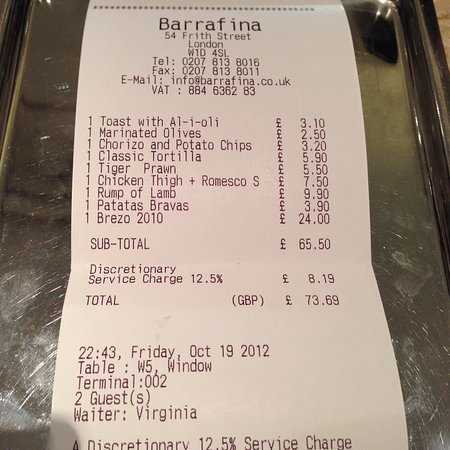
Where is `table`? This screenshot has height=450, width=450. table is located at coordinates (35, 304).